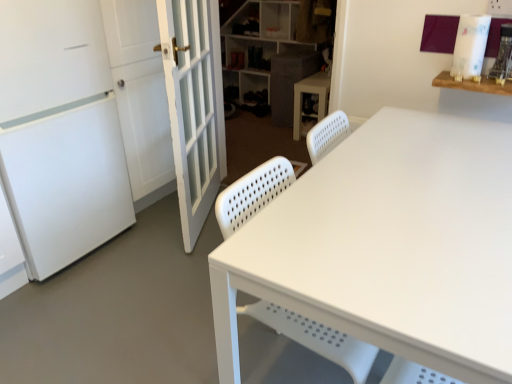
Question: Based on their sizes in the image, would you say white perforated plastic swivel chair at center is bigger or smaller than white glass door at left?

Choices:
 (A) small
 (B) big

Answer: (B)

Question: In the image, is white perforated plastic swivel chair at center on the left side or the right side of white glass door at left?

Choices:
 (A) right
 (B) left

Answer: (A)

Question: Estimate the real-world distances between objects in this image. Which object is farther from the wooden shelf at upper right?

Choices:
 (A) textured gray cabinet at center
 (B) white plastic shelf at upper center
 (C) white matte screen door at left
 (D) white plastic cabinet at center
 (E) white perforated plastic swivel chair at center

Answer: (B)

Question: Which of these objects is positioned farthest from the white glass door at left?

Choices:
 (A) wooden shelf at upper right
 (B) white perforated plastic swivel chair at center
 (C) white matte screen door at left
 (D) textured gray cabinet at center
 (E) white plastic shelf at upper center

Answer: (E)